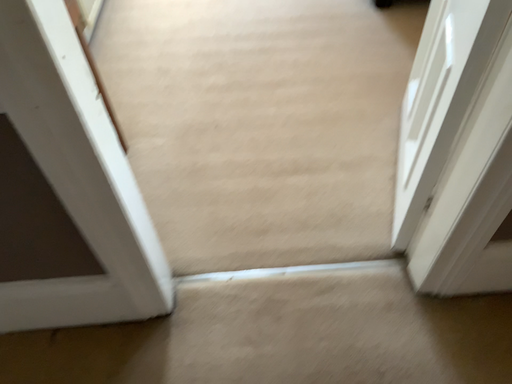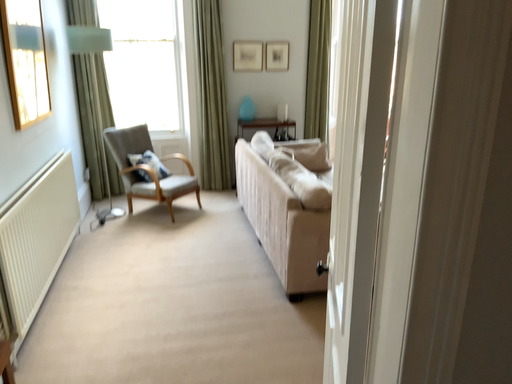
Question: How did the camera likely rotate when shooting the video?

Choices:
 (A) rotated upward
 (B) rotated downward

Answer: (A)